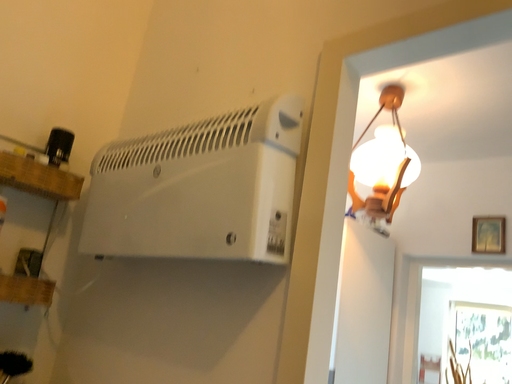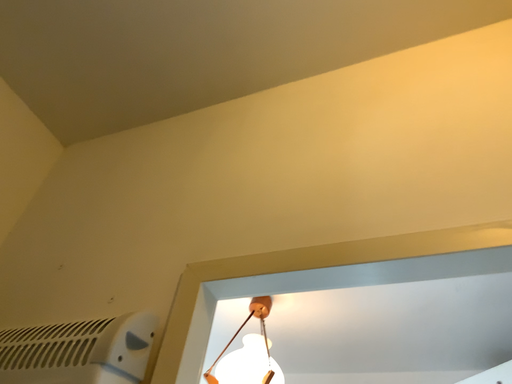
Question: Which way did the camera rotate in the video?

Choices:
 (A) rotated right
 (B) rotated left

Answer: (A)